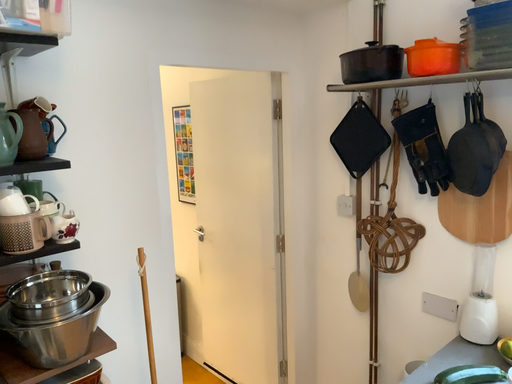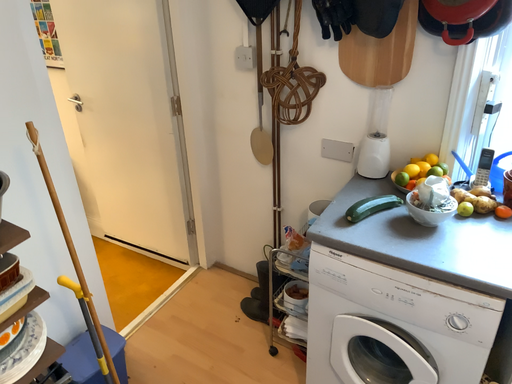
Question: How did the camera likely rotate when shooting the video?

Choices:
 (A) rotated right
 (B) rotated left

Answer: (A)